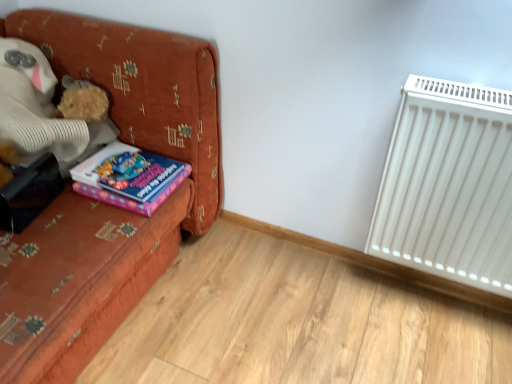
Locate an element on the screen. The height and width of the screenshot is (384, 512). vacant region below white plastic radiator at right (from a real-world perspective) is located at coordinates tap(423, 295).